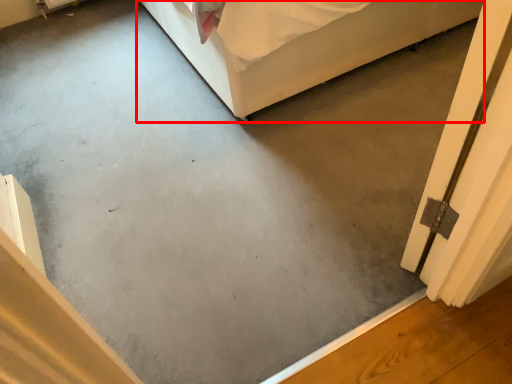
Question: From the image's perspective, considering the relative positions of furniture (annotated by the red box) and screen door in the image provided, where is furniture (annotated by the red box) located with respect to the staircase?

Choices:
 (A) above
 (B) below

Answer: (A)